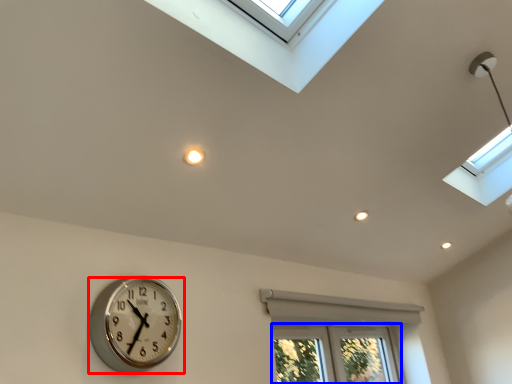
Question: Which object is further to the camera taking this photo, wall clock (highlighted by a red box) or bay window (highlighted by a blue box)?

Choices:
 (A) wall clock
 (B) bay window

Answer: (B)